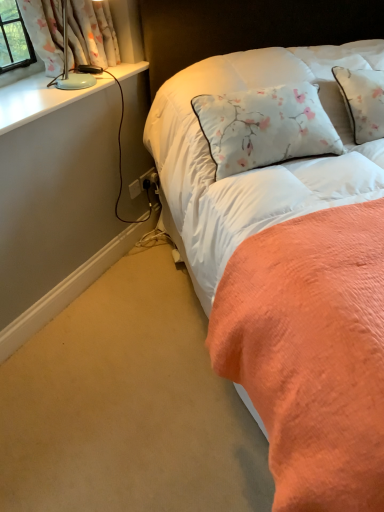
Question: Are floral fabric pillow at upper right and white plastic electrical outlet at lower center making contact?

Choices:
 (A) yes
 (B) no

Answer: (B)

Question: From a real-world perspective, is floral fabric pillow at upper right on top of white plastic electrical outlet at lower center?

Choices:
 (A) yes
 (B) no

Answer: (A)

Question: Can you confirm if floral fabric pillow at upper right is thinner than white plastic electrical outlet at lower center?

Choices:
 (A) no
 (B) yes

Answer: (A)

Question: Does floral fabric pillow at upper right appear on the right side of white plastic electrical outlet at lower center?

Choices:
 (A) yes
 (B) no

Answer: (A)

Question: Is floral fabric pillow at upper right smaller than white plastic electrical outlet at lower center?

Choices:
 (A) yes
 (B) no

Answer: (B)

Question: Do you think white plastic electrical outlet at lower center is within white glossy window sill at upper left, or outside of it?

Choices:
 (A) outside
 (B) inside

Answer: (A)

Question: From a real-world perspective, relative to white glossy window sill at upper left, is white plastic electrical outlet at lower center vertically above or below?

Choices:
 (A) below
 (B) above

Answer: (A)

Question: Considering the positions of point (142, 182) and point (127, 74), is point (142, 182) closer or farther from the camera than point (127, 74)?

Choices:
 (A) farther
 (B) closer

Answer: (A)

Question: From their relative heights in the image, would you say white plastic electrical outlet at lower center is taller or shorter than white glossy window sill at upper left?

Choices:
 (A) tall
 (B) short

Answer: (A)

Question: Is white glossy window sill at upper left wider or thinner than white floral fabric at upper left?

Choices:
 (A) thin
 (B) wide

Answer: (B)

Question: Would you say white glossy window sill at upper left is to the left or to the right of white floral fabric at upper left in the picture?

Choices:
 (A) left
 (B) right

Answer: (A)

Question: Considering their positions, is white glossy window sill at upper left located in front of or behind white floral fabric at upper left?

Choices:
 (A) behind
 (B) front

Answer: (B)

Question: Looking at the image, does white glossy window sill at upper left seem bigger or smaller compared to white floral fabric at upper left?

Choices:
 (A) small
 (B) big

Answer: (A)

Question: Is white floral fabric at upper left taller or shorter than floral fabric pillow at upper right?

Choices:
 (A) tall
 (B) short

Answer: (B)

Question: From the image's perspective, is white floral fabric at upper left positioned above or below floral fabric pillow at upper right?

Choices:
 (A) above
 (B) below

Answer: (A)